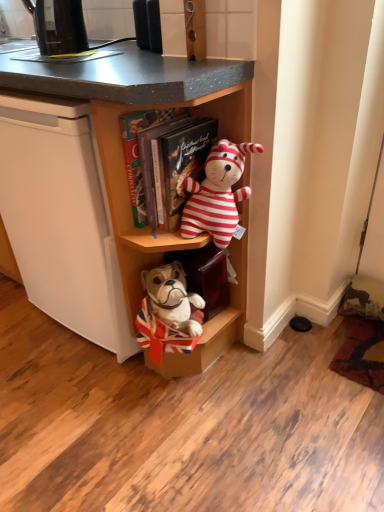
Question: Is striped plush toy at center thinner than wooden cabinet at center?

Choices:
 (A) yes
 (B) no

Answer: (A)

Question: Does striped plush toy at center have a greater height compared to wooden cabinet at center?

Choices:
 (A) yes
 (B) no

Answer: (B)

Question: Is striped plush toy at center facing away from wooden cabinet at center?

Choices:
 (A) no
 (B) yes

Answer: (B)

Question: Is striped plush toy at center at the left side of wooden cabinet at center?

Choices:
 (A) yes
 (B) no

Answer: (B)

Question: Is striped plush toy at center wider than wooden cabinet at center?

Choices:
 (A) yes
 (B) no

Answer: (B)

Question: Visually, is wooden bookshelf at center positioned to the left or to the right of black plastic kettle at upper left?

Choices:
 (A) right
 (B) left

Answer: (A)

Question: Is point (223, 130) positioned closer to the camera than point (61, 20)?

Choices:
 (A) farther
 (B) closer

Answer: (B)

Question: Looking at the image, does wooden bookshelf at center seem bigger or smaller compared to black plastic kettle at upper left?

Choices:
 (A) big
 (B) small

Answer: (A)

Question: From their relative heights in the image, would you say wooden bookshelf at center is taller or shorter than black plastic kettle at upper left?

Choices:
 (A) short
 (B) tall

Answer: (B)

Question: From the image's perspective, is black plastic kettle at upper left above or below wooden cabinet at center?

Choices:
 (A) above
 (B) below

Answer: (A)

Question: From their relative heights in the image, would you say black plastic kettle at upper left is taller or shorter than wooden cabinet at center?

Choices:
 (A) tall
 (B) short

Answer: (B)

Question: Considering the relative positions of black plastic kettle at upper left and wooden cabinet at center in the image provided, is black plastic kettle at upper left to the left or to the right of wooden cabinet at center?

Choices:
 (A) left
 (B) right

Answer: (A)

Question: Choose the correct answer: Is black plastic kettle at upper left inside wooden cabinet at center or outside it?

Choices:
 (A) outside
 (B) inside

Answer: (A)

Question: Looking at their shapes, would you say striped plush toy at center is wider or thinner than black plastic kettle at upper left?

Choices:
 (A) wide
 (B) thin

Answer: (A)

Question: Is striped plush toy at center bigger or smaller than black plastic kettle at upper left?

Choices:
 (A) small
 (B) big

Answer: (B)